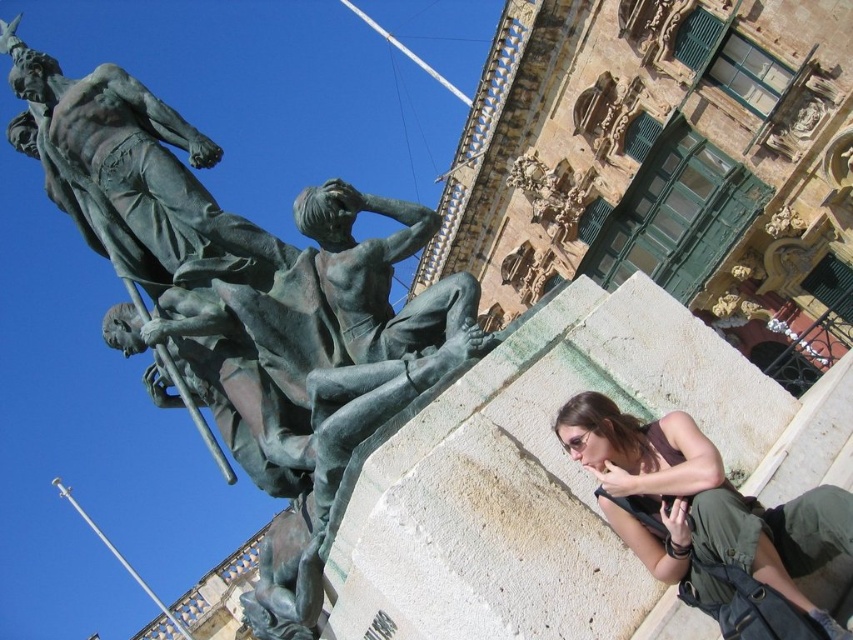
You are an architect reviewing the statue and its placement in the scene. You need to determine which of the two points, point (x=421, y=230) or point (x=128, y=232), is closer to the camera. Which one is closer?

Point (x=421, y=230) is closer to the camera than point (x=128, y=232).

You are an art student analyzing the spatial relationships in the image. You observe the green patina statue at upper left and the matte brown hair at lower right. Which object occupies a higher position in the image?

The green patina statue at upper left occupies a higher position in the image than the matte brown hair at lower right because it is taller.

You are standing in front of the large bronze statue and want to take a photo. You notice two points on the statue labeled as point (77, 202) and point (663, 525). Which point is closer to your camera when you take the photo?

Point (77, 202) is further to the camera than point (663, 525), so the point closer to the camera is point (663, 525).